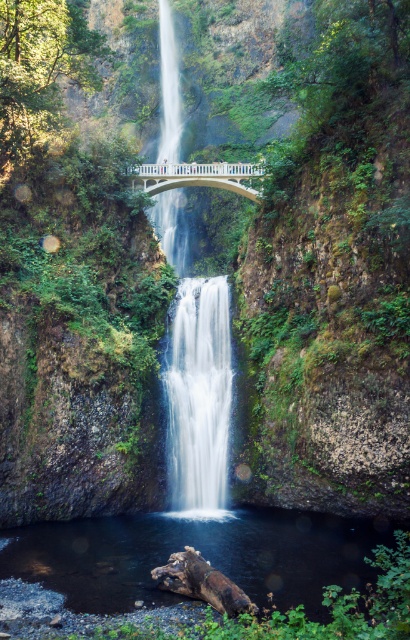
Question: Considering the real-world distances, which object is farthest from the white smooth waterfall at center?

Choices:
 (A) smooth brown log at lower center
 (B) white concrete bridge at center

Answer: (A)

Question: Can you confirm if smooth brown log at lower center is positioned below white smooth waterfall at center?

Choices:
 (A) yes
 (B) no

Answer: (A)

Question: Which of the following is the closest to the observer?

Choices:
 (A) smooth brown log at lower center
 (B) white concrete bridge at center

Answer: (A)

Question: Can you confirm if smooth brown log at lower center is positioned to the right of white smooth waterfall at center?

Choices:
 (A) no
 (B) yes

Answer: (B)

Question: Can you confirm if smooth brown log at lower center is positioned above white smooth waterfall at center?

Choices:
 (A) no
 (B) yes

Answer: (A)

Question: Among these objects, which one is nearest to the camera?

Choices:
 (A) smooth brown log at lower center
 (B) white smooth waterfall at center

Answer: (A)